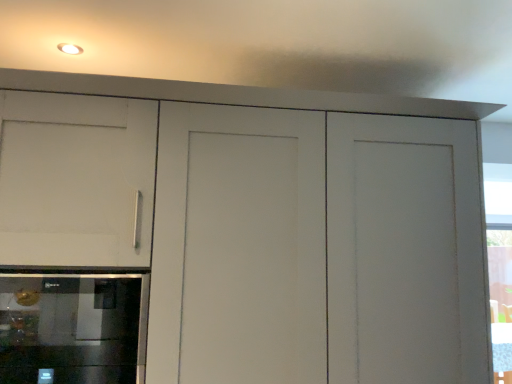
The width and height of the screenshot is (512, 384). Identify the location of stainless steel oven at lower left. (73, 328).

Image resolution: width=512 pixels, height=384 pixels. What do you see at coordinates (73, 328) in the screenshot?
I see `stainless steel oven at lower left` at bounding box center [73, 328].

Measure the distance between point (71, 317) and camera.

The depth of point (71, 317) is 4.47 feet.

Identify the location of stainless steel oven at lower left. (73, 328).